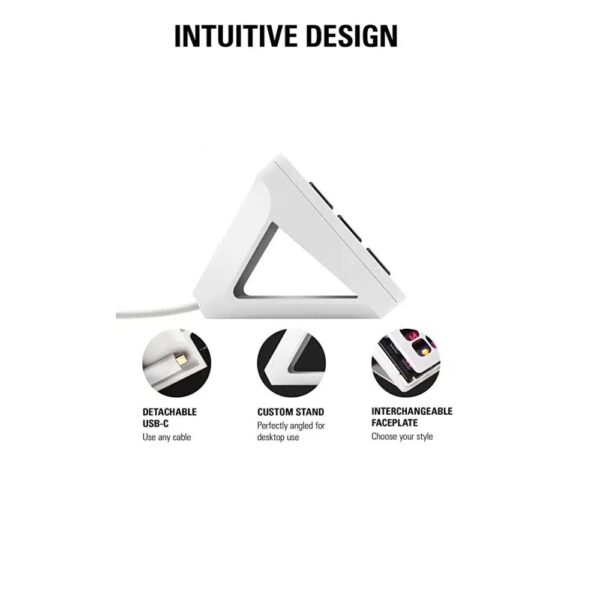
Find the location of `usb-c charger`. usb-c charger is located at coordinates point(176,364).